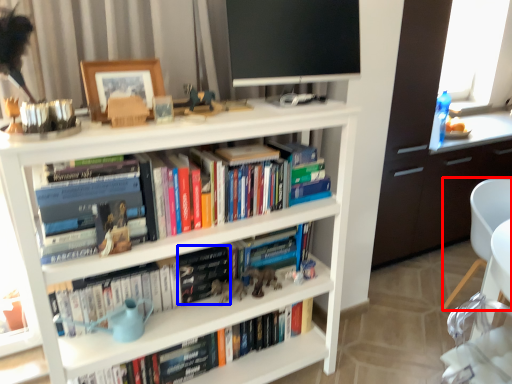
Question: Which object is closer to the camera taking this photo, chair (highlighted by a red box) or paperback book (highlighted by a blue box)?

Choices:
 (A) chair
 (B) paperback book

Answer: (B)